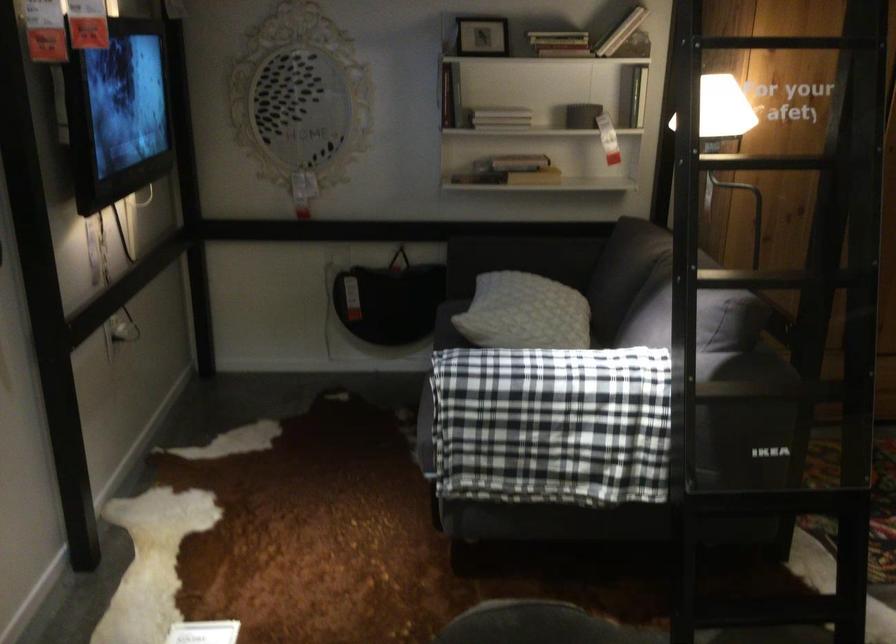
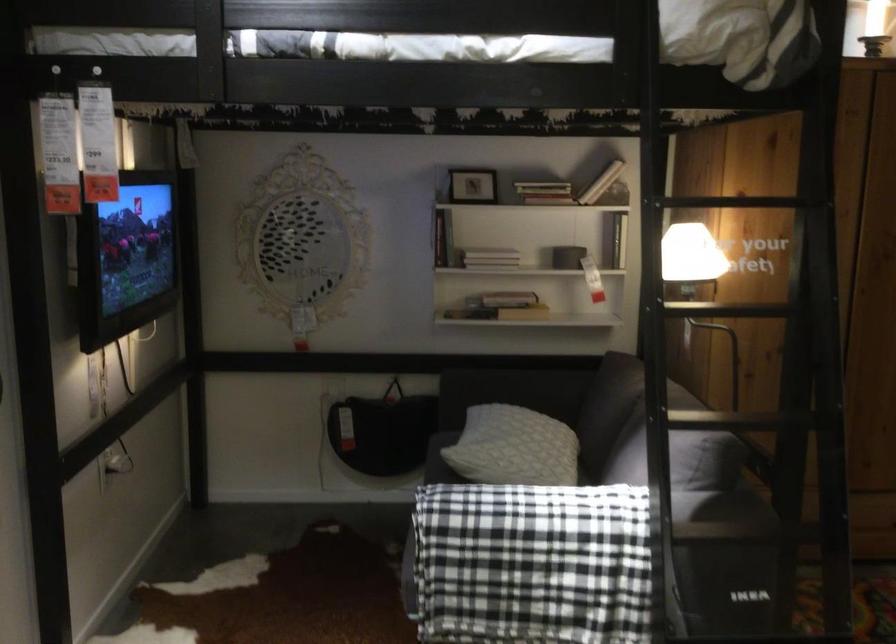
Question: How did the camera likely rotate?

Choices:
 (A) Left
 (B) Right
 (C) Up
 (D) Down

Answer: (C)